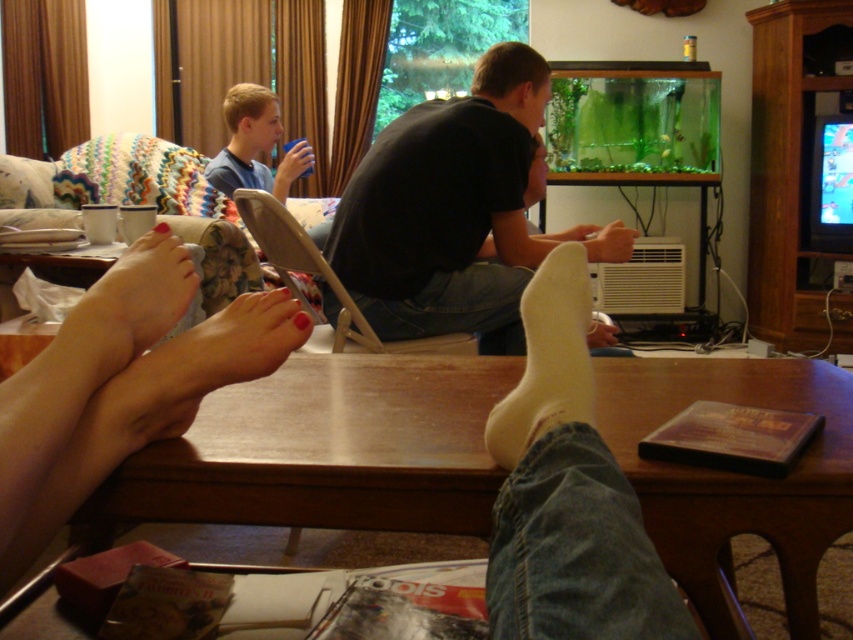
Can you confirm if white sock at lower right is bigger than white soft sock at lower center?

Indeed, white sock at lower right has a larger size compared to white soft sock at lower center.

Between white sock at lower right and white soft sock at lower center, which one has less height?

Standing shorter between the two is white soft sock at lower center.

Where is `white sock at lower right`? The image size is (853, 640). white sock at lower right is located at coordinates (567, 492).

Locate an element on the screen. black matte shirt at center is located at coordinates (456, 211).

Does white sock at lower right come in front of black matte shirt at center?

Yes, white sock at lower right is closer to the viewer.

Between point (527, 289) and point (497, 218), which one is positioned behind?

The point (497, 218) is more distant.

You are a GUI agent. You are given a task and a screenshot of the screen. Output one action in this format:
    pyautogui.click(x=<x>, y=<y>)
    Task: Click on the white sock at lower right
    The width and height of the screenshot is (853, 640).
    Given the screenshot: What is the action you would take?
    pyautogui.click(x=567, y=492)